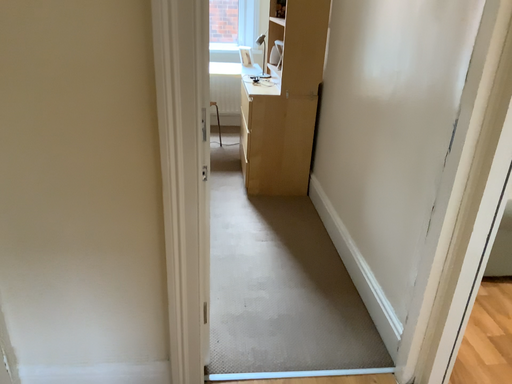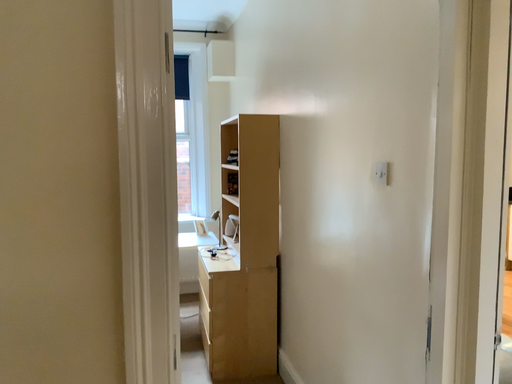
Question: How did the camera likely rotate when shooting the video?

Choices:
 (A) rotated upward
 (B) rotated downward

Answer: (A)